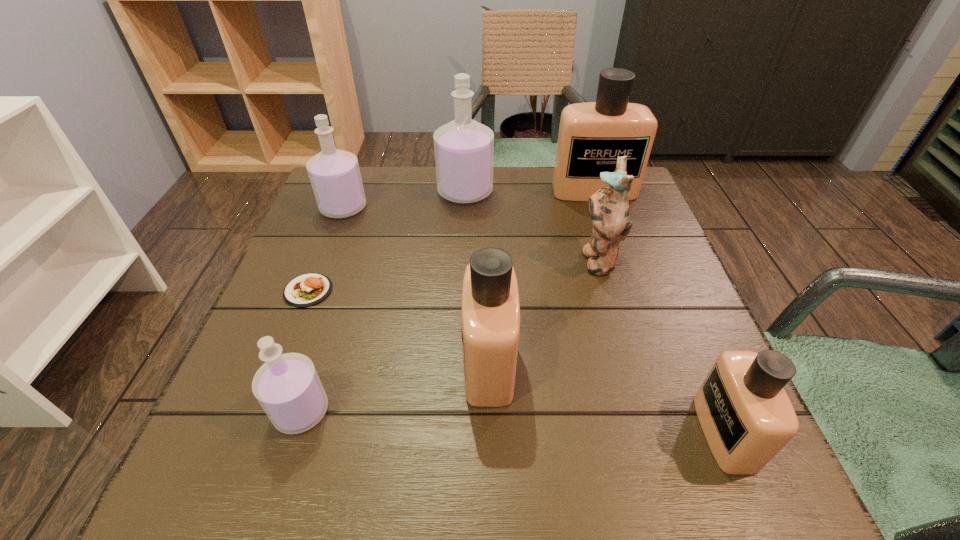
Identify the location of free space located 0.220m on the front label of the smallest beige perfume. pyautogui.click(x=561, y=433).

This screenshot has height=540, width=960. Identify the location of vacant space located 0.290m on the front of the shortest object. (245, 453).

At what (x,y) coordinates should I click in order to perform the action: click on object at the near edge. Please return your answer as a coordinate pair (x, y). Looking at the image, I should click on (747, 417).

This screenshot has height=540, width=960. In order to click on patty (food) located at the left edge in this screenshot , I will do `click(309, 289)`.

Where is `figurine that is at the right edge`? figurine that is at the right edge is located at coordinates (609, 208).

Where is `object that is at the far left corner`? The width and height of the screenshot is (960, 540). object that is at the far left corner is located at coordinates (334, 174).

You are a GUI agent. You are given a task and a screenshot of the screen. Output one action in this format:
    pyautogui.click(x=<x>, y=<y>)
    Task: Click on the object located in the far right corner section of the desktop
    This screenshot has width=960, height=540.
    Given the screenshot: What is the action you would take?
    pyautogui.click(x=592, y=135)

The image size is (960, 540). Find the location of `object that is at the near right corner`. object that is at the near right corner is located at coordinates point(747,417).

The image size is (960, 540). In order to click on vacant point at the far edge in this screenshot , I will do `click(399, 205)`.

Find the location of a particular element. This screenshot has width=960, height=540. vacant space at the near edge of the desktop is located at coordinates (530, 466).